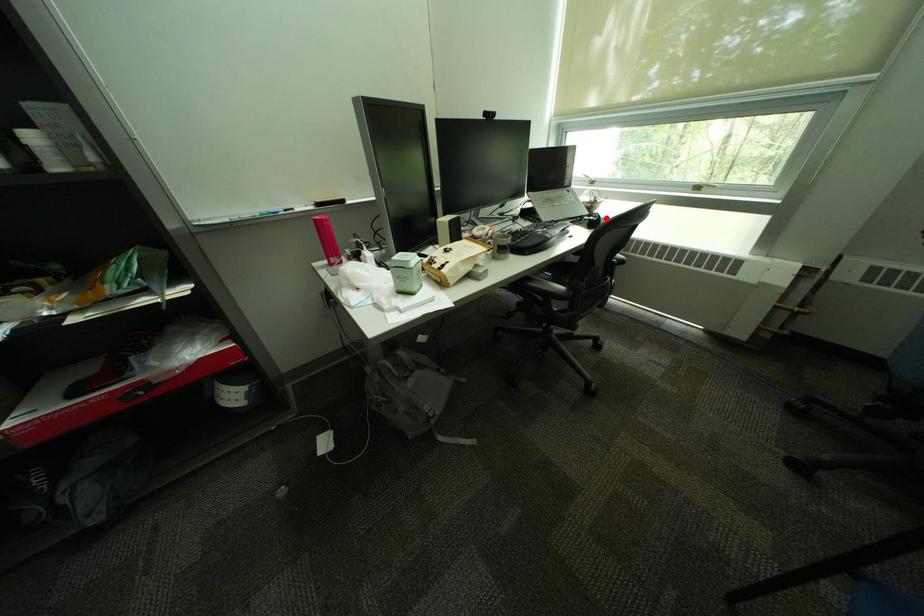
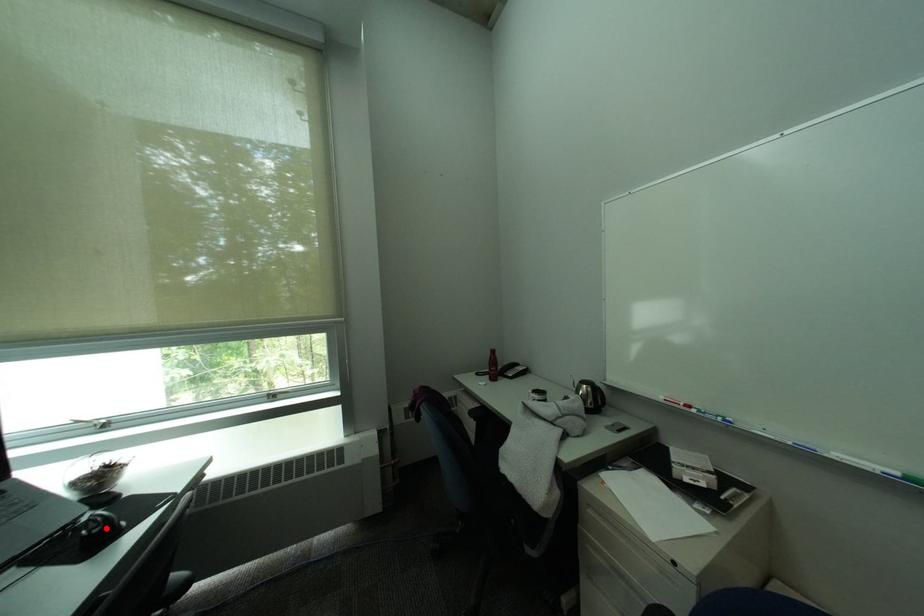
I am providing you with two images of the same scene from different viewpoints. A red point is marked on the first image and another point is marked on the second image. Is the marked point in image1 the same physical position as the marked point in image2?

Yes